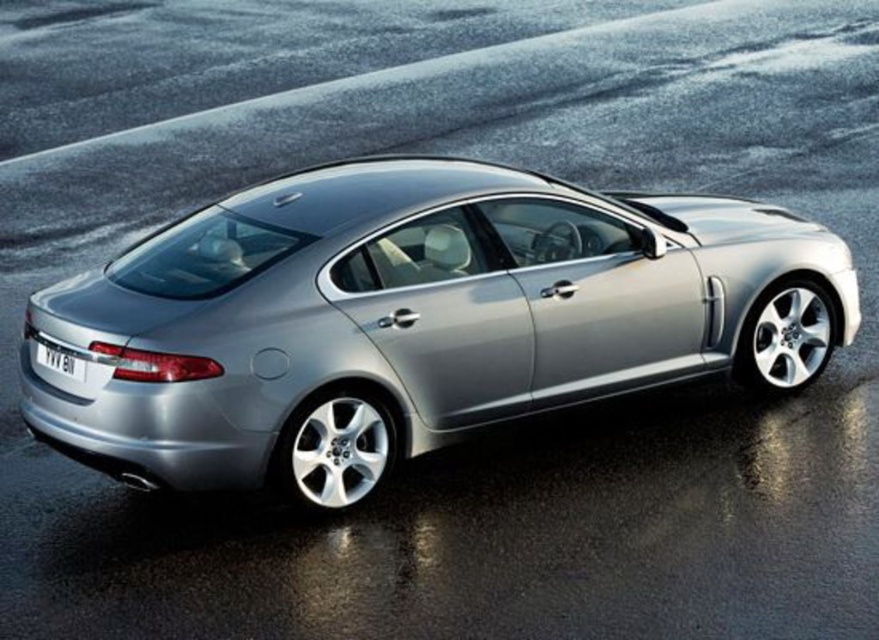
From the picture: You are a parking attendant who needs to fit the satin silver car at center into a parking spot that is exactly the same width as the black plastic license plate at lower center. Can the car fit into the spot?

The satin silver car at center is wider than the black plastic license plate at lower center, so it cannot fit into a parking spot that is the same width as the license plate.

You are a parking attendant who needs to clean the license plate of the satin silver car at center. Since the car is parked over the black plastic license plate at lower center, can you directly access the license plate without moving the car?

The satin silver car at center is positioned over the black plastic license plate at lower center, so you cannot directly access the license plate without moving the car.